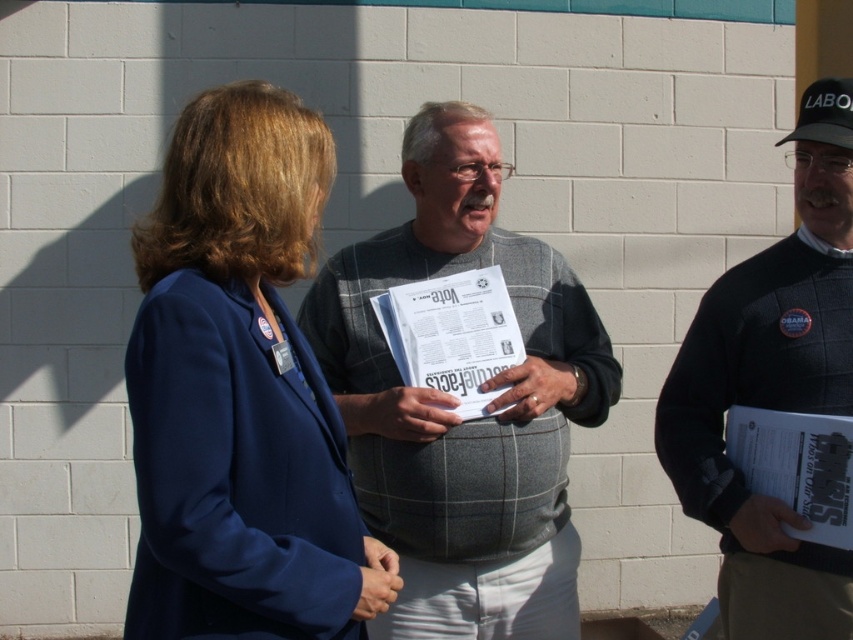
You are a photographer who wants to ensure that both the navy blue blazer at center and the white paper at center are clearly visible in your photo. Based on their sizes, which object should you focus on first to ensure proper exposure?

The navy blue blazer at center has a larger size compared to the white paper at center, so you should focus on the navy blue blazer at center first to ensure proper exposure.

You are a photographer trying to capture a clear shot of the black sweater at center and the white paper at center. Which object should you focus on first if you want to ensure both are in focus without adjusting the camera settings?

The black sweater at center has a larger size compared to white paper at center, so focusing on the larger black sweater at center first will help ensure both objects are in focus since it requires less precision due to its size.